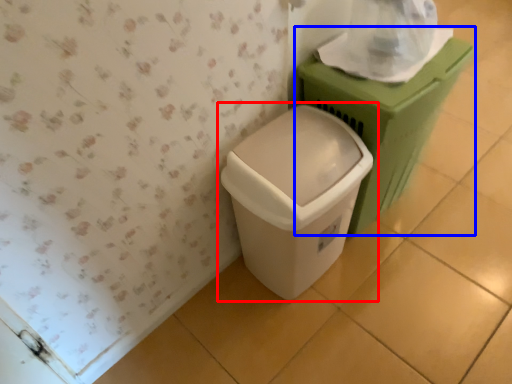
Question: Which point is closer to the camera, waste container (highlighted by a red box) or waste container (highlighted by a blue box)?

Choices:
 (A) waste container
 (B) waste container

Answer: (A)